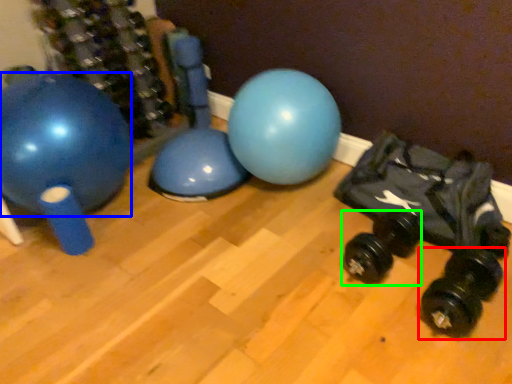
Question: Which object is positioned farthest from dumbbell (highlighted by a red box)? Select from ball (highlighted by a blue box) and dumbbell (highlighted by a green box).

Choices:
 (A) ball
 (B) dumbbell

Answer: (A)